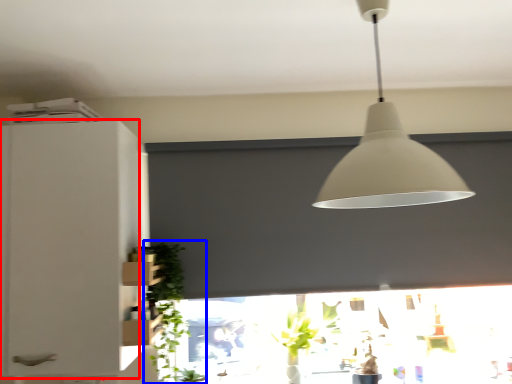
Question: Which object appears farthest to the camera in this image, cabinetry (highlighted by a red box) or plant (highlighted by a blue box)?

Choices:
 (A) cabinetry
 (B) plant

Answer: (B)